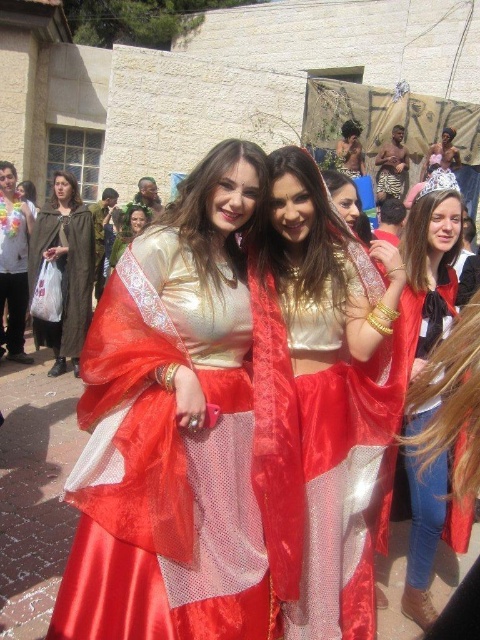
Question: Does satin gold dress at center appear over brown woolen cloak at left?

Choices:
 (A) yes
 (B) no

Answer: (B)

Question: Which object appears closest to the camera in this image?

Choices:
 (A) shiny silk dress at center
 (B) satin gold dress at center

Answer: (B)

Question: Considering the relative positions of satin gold dress at center and brown woolen cloak at left in the image provided, where is satin gold dress at center located with respect to brown woolen cloak at left?

Choices:
 (A) right
 (B) left

Answer: (A)

Question: Which point is closer to the camera?

Choices:
 (A) brown woolen cloak at left
 (B) matte gold crown at upper right

Answer: (B)

Question: Does satin gold dress at center appear on the left side of brown woolen cloak at left?

Choices:
 (A) yes
 (B) no

Answer: (B)

Question: Among these objects, which one is farthest from the camera?

Choices:
 (A) silky gold robe at center
 (B) matte gold crown at upper right
 (C) brown woolen cloak at left

Answer: (A)